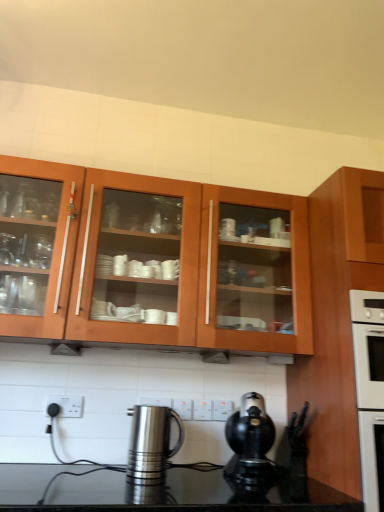
Describe the element at coordinates (155, 261) in the screenshot. The image size is (384, 512). I see `wooden cabinet at upper center, which ranks as the second cabinetry in right-to-left order` at that location.

Describe the element at coordinates (250, 442) in the screenshot. This screenshot has height=512, width=384. I see `black plastic coffee maker at lower center, which ranks as the 2th kitchen appliance in left-to-right order` at that location.

From the picture: How much space does white plastic electric outlet at lower center, marked as the first electric outlet in a left-to-right arrangement, occupy horizontally?

white plastic electric outlet at lower center, marked as the first electric outlet in a left-to-right arrangement, is 0.79 inches in width.

What do you see at coordinates (222, 409) in the screenshot? The image size is (384, 512). I see `white plastic electric outlet at center, positioned as the third electric outlet in left-to-right order` at bounding box center [222, 409].

Where is `white plastic electric outlet at center, which is counted as the 3th electric outlet, starting from the front`? The image size is (384, 512). white plastic electric outlet at center, which is counted as the 3th electric outlet, starting from the front is located at coordinates (222, 409).

This screenshot has width=384, height=512. I want to click on polished stainless steel kettle at lower center, the second kitchen appliance from the right, so click(151, 443).

Locate an element on the screen. wooden cabinet at upper center, arranged as the 1th cabinetry when viewed from the left is located at coordinates (155, 261).

From a real-world perspective, relative to white plastic electric outlet at center, positioned as the third electric outlet in left-to-right order, is white plastic electric outlet at lower center, acting as the first electric outlet starting from the front, vertically above or below?

white plastic electric outlet at lower center, acting as the first electric outlet starting from the front, is situated lower than white plastic electric outlet at center, positioned as the third electric outlet in left-to-right order, in the real world.

From the image's perspective, between white plastic electric outlet at lower center, which is the third electric outlet in right-to-left order, and white plastic electric outlet at center, acting as the first electric outlet starting from the right, who is located below?

white plastic electric outlet at center, acting as the first electric outlet starting from the right, from the image's perspective.

Does white plastic electric outlet at lower center, acting as the first electric outlet starting from the front, turn towards white plastic electric outlet at center, positioned as the third electric outlet in left-to-right order?

No.

Choose the correct answer: Is polished stainless steel kettle at lower center, which appears as the 1th kitchen appliance when viewed from the left, inside black plastic coffee maker at lower center, which ranks as the 2th kitchen appliance in left-to-right order, or outside it?

polished stainless steel kettle at lower center, which appears as the 1th kitchen appliance when viewed from the left, is outside black plastic coffee maker at lower center, which ranks as the 2th kitchen appliance in left-to-right order.

Does polished stainless steel kettle at lower center, the second kitchen appliance from the right, have a lesser height compared to black plastic coffee maker at lower center, placed as the first kitchen appliance when sorted from right to left?

Yes, polished stainless steel kettle at lower center, the second kitchen appliance from the right, is shorter than black plastic coffee maker at lower center, placed as the first kitchen appliance when sorted from right to left.

How different are the orientations of polished stainless steel kettle at lower center, the second kitchen appliance from the right, and black plastic coffee maker at lower center, which ranks as the 2th kitchen appliance in left-to-right order, in degrees?

They differ by 10.5 degrees in their facing directions.

Does white plastic electric outlet at lower center, which is the 3th electric outlet from back to front, have a smaller size compared to white plastic electric outlet at center, the 2th electric outlet viewed from the front?

Incorrect, white plastic electric outlet at lower center, which is the 3th electric outlet from back to front, is not smaller in size than white plastic electric outlet at center, the 2th electric outlet viewed from the front.

Which is correct: white plastic electric outlet at lower center, acting as the first electric outlet starting from the front, is inside white plastic electric outlet at center, which ranks as the 2th electric outlet in back-to-front order, or outside of it?

white plastic electric outlet at lower center, acting as the first electric outlet starting from the front, exists outside the volume of white plastic electric outlet at center, which ranks as the 2th electric outlet in back-to-front order.

Considering the relative sizes of white plastic electric outlet at lower center, acting as the first electric outlet starting from the front, and white plastic electric outlet at center, the 2th electric outlet positioned from the right, in the image provided, is white plastic electric outlet at lower center, acting as the first electric outlet starting from the front, thinner than white plastic electric outlet at center, the 2th electric outlet positioned from the right,?

Yes.

Which point is more distant from viewer, [73,414] or [190,419]?

The point [190,419] is behind.

Is white plastic electric outlet at center, which is counted as the 3th electric outlet, starting from the front, turned away from white plastic electric outlet at center, which ranks as the 2th electric outlet in back-to-front order?

No, white plastic electric outlet at center, which is counted as the 3th electric outlet, starting from the front, is not facing away from white plastic electric outlet at center, which ranks as the 2th electric outlet in back-to-front order.

Considering the relative sizes of white plastic electric outlet at center, which is counted as the 3th electric outlet, starting from the front, and white plastic electric outlet at center, the 2th electric outlet viewed from the front, in the image provided, is white plastic electric outlet at center, which is counted as the 3th electric outlet, starting from the front, smaller than white plastic electric outlet at center, the 2th electric outlet viewed from the front,?

Incorrect, white plastic electric outlet at center, which is counted as the 3th electric outlet, starting from the front, is not smaller in size than white plastic electric outlet at center, the 2th electric outlet viewed from the front.

Looking at this image, which is more to the left, white plastic electric outlet at center, positioned as the third electric outlet in left-to-right order, or white plastic electric outlet at center, which ranks as the 2th electric outlet in back-to-front order?

white plastic electric outlet at center, which ranks as the 2th electric outlet in back-to-front order, is more to the left.

At what (x,y) coordinates should I click in order to perform the action: click on electric outlet on the right of white plastic electric outlet at center, the 2th electric outlet positioned from the right. Please return your answer as a coordinate pair (x, y). This screenshot has width=384, height=512. Looking at the image, I should click on (222, 409).

From a real-world perspective, is white plastic electric outlet at center, marked as the first electric outlet in a back-to-front arrangement, positioned above or below black plastic coffee maker at lower center, placed as the first kitchen appliance when sorted from right to left?

From a real-world perspective, white plastic electric outlet at center, marked as the first electric outlet in a back-to-front arrangement, is physically above black plastic coffee maker at lower center, placed as the first kitchen appliance when sorted from right to left.

From the image's perspective, which one is positioned higher, white plastic electric outlet at center, which is counted as the 3th electric outlet, starting from the front, or black plastic coffee maker at lower center, placed as the first kitchen appliance when sorted from right to left?

white plastic electric outlet at center, which is counted as the 3th electric outlet, starting from the front, appears higher in the image.

Considering the sizes of white plastic electric outlet at center, positioned as the third electric outlet in left-to-right order, and black plastic coffee maker at lower center, placed as the first kitchen appliance when sorted from right to left, in the image, is white plastic electric outlet at center, positioned as the third electric outlet in left-to-right order, bigger or smaller than black plastic coffee maker at lower center, placed as the first kitchen appliance when sorted from right to left,?

Considering their sizes, white plastic electric outlet at center, positioned as the third electric outlet in left-to-right order, takes up less space than black plastic coffee maker at lower center, placed as the first kitchen appliance when sorted from right to left.

Between wooden cabinet at right, marked as the second cabinetry in a left-to-right arrangement, and polished stainless steel kettle at lower center, the second kitchen appliance from the right, which one has smaller size?

polished stainless steel kettle at lower center, the second kitchen appliance from the right, is smaller.

Who is taller, wooden cabinet at right, marked as the second cabinetry in a left-to-right arrangement, or polished stainless steel kettle at lower center, the second kitchen appliance from the right?

With more height is wooden cabinet at right, marked as the second cabinetry in a left-to-right arrangement.

Is wooden cabinet at right, the first cabinetry from the right, positioned with its back to polished stainless steel kettle at lower center, which appears as the 1th kitchen appliance when viewed from the left?

No, wooden cabinet at right, the first cabinetry from the right, is not facing away from polished stainless steel kettle at lower center, which appears as the 1th kitchen appliance when viewed from the left.

Considering the relative positions of wooden cabinet at right, the first cabinetry from the right, and polished stainless steel kettle at lower center, which appears as the 1th kitchen appliance when viewed from the left, in the image provided, is wooden cabinet at right, the first cabinetry from the right, to the left of polished stainless steel kettle at lower center, which appears as the 1th kitchen appliance when viewed from the left, from the viewer's perspective?

Incorrect, wooden cabinet at right, the first cabinetry from the right, is not on the left side of polished stainless steel kettle at lower center, which appears as the 1th kitchen appliance when viewed from the left.

Consider the image. Is white plastic electric outlet at lower center, acting as the first electric outlet starting from the front, looking in the opposite direction of wooden cabinet at upper center, which ranks as the second cabinetry in right-to-left order?

No.

Considering the relative sizes of white plastic electric outlet at lower center, which is the third electric outlet in right-to-left order, and wooden cabinet at upper center, which ranks as the second cabinetry in right-to-left order, in the image provided, is white plastic electric outlet at lower center, which is the third electric outlet in right-to-left order, bigger than wooden cabinet at upper center, which ranks as the second cabinetry in right-to-left order,?

Incorrect, white plastic electric outlet at lower center, which is the third electric outlet in right-to-left order, is not larger than wooden cabinet at upper center, which ranks as the second cabinetry in right-to-left order.

Is white plastic electric outlet at lower center, which is the 3th electric outlet from back to front, far away from wooden cabinet at upper center, arranged as the 1th cabinetry when viewed from the left?

No.

Do you think white plastic electric outlet at lower center, marked as the first electric outlet in a left-to-right arrangement, is within wooden cabinet at upper center, which ranks as the second cabinetry in right-to-left order, or outside of it?

white plastic electric outlet at lower center, marked as the first electric outlet in a left-to-right arrangement, lies outside wooden cabinet at upper center, which ranks as the second cabinetry in right-to-left order.

Identify the location of the 2nd electric outlet to the right when counting from the white plastic electric outlet at lower center, which is the 3th electric outlet from back to front. The height and width of the screenshot is (512, 384). (222, 409).

Locate an element on the screen. kitchen appliance on the left of black plastic coffee maker at lower center, which ranks as the 2th kitchen appliance in left-to-right order is located at coordinates (151, 443).

Considering their positions, is white plastic electric outlet at center, positioned as the third electric outlet in left-to-right order, positioned further to wooden cabinet at upper center, which ranks as the second cabinetry in right-to-left order, than white plastic electric outlet at lower center, marked as the first electric outlet in a left-to-right arrangement?

The object further to wooden cabinet at upper center, which ranks as the second cabinetry in right-to-left order, is white plastic electric outlet at lower center, marked as the first electric outlet in a left-to-right arrangement.

From the image, which object appears to be farther from polished stainless steel kettle at lower center, which appears as the 1th kitchen appliance when viewed from the left, wooden cabinet at right, marked as the second cabinetry in a left-to-right arrangement, or white plastic electric outlet at center, acting as the first electric outlet starting from the right?

wooden cabinet at right, marked as the second cabinetry in a left-to-right arrangement, lies further to polished stainless steel kettle at lower center, which appears as the 1th kitchen appliance when viewed from the left, than the other object.

Considering their positions, is white plastic electric outlet at center, marked as the first electric outlet in a back-to-front arrangement, positioned closer to black plastic coffee maker at lower center, placed as the first kitchen appliance when sorted from right to left, than wooden cabinet at upper center, which ranks as the second cabinetry in right-to-left order?

Based on the image, white plastic electric outlet at center, marked as the first electric outlet in a back-to-front arrangement, appears to be nearer to black plastic coffee maker at lower center, placed as the first kitchen appliance when sorted from right to left.

From the image, which object appears to be farther from white plastic electric outlet at center, positioned as the third electric outlet in left-to-right order, polished stainless steel kettle at lower center, which appears as the 1th kitchen appliance when viewed from the left, or wooden cabinet at upper center, arranged as the 1th cabinetry when viewed from the left?

wooden cabinet at upper center, arranged as the 1th cabinetry when viewed from the left, is further to white plastic electric outlet at center, positioned as the third electric outlet in left-to-right order.

When comparing their distances from white plastic electric outlet at center, the 2th electric outlet positioned from the right, does wooden cabinet at right, marked as the second cabinetry in a left-to-right arrangement, or black plastic coffee maker at lower center, which ranks as the 2th kitchen appliance in left-to-right order, seem closer?

Among the two, black plastic coffee maker at lower center, which ranks as the 2th kitchen appliance in left-to-right order, is located nearer to white plastic electric outlet at center, the 2th electric outlet positioned from the right.

From the image, which object appears to be farther from polished stainless steel kettle at lower center, which appears as the 1th kitchen appliance when viewed from the left, wooden cabinet at right, marked as the second cabinetry in a left-to-right arrangement, or white plastic electric outlet at lower center, acting as the first electric outlet starting from the front?

wooden cabinet at right, marked as the second cabinetry in a left-to-right arrangement, lies further to polished stainless steel kettle at lower center, which appears as the 1th kitchen appliance when viewed from the left, than the other object.

When comparing their distances from black plastic coffee maker at lower center, placed as the first kitchen appliance when sorted from right to left, does wooden cabinet at right, the first cabinetry from the right, or white plastic electric outlet at lower center, marked as the first electric outlet in a left-to-right arrangement, seem further?

Based on the image, white plastic electric outlet at lower center, marked as the first electric outlet in a left-to-right arrangement, appears to be further to black plastic coffee maker at lower center, placed as the first kitchen appliance when sorted from right to left.

Considering their positions, is wooden cabinet at upper center, which ranks as the second cabinetry in right-to-left order, positioned closer to wooden cabinet at right, the first cabinetry from the right, than polished stainless steel kettle at lower center, which appears as the 1th kitchen appliance when viewed from the left?

wooden cabinet at upper center, which ranks as the second cabinetry in right-to-left order.

This screenshot has height=512, width=384. Find the location of `kitchen appliance between white plastic electric outlet at lower center, which is the 3th electric outlet from back to front, and white plastic electric outlet at center, positioned as the third electric outlet in left-to-right order`. kitchen appliance between white plastic electric outlet at lower center, which is the 3th electric outlet from back to front, and white plastic electric outlet at center, positioned as the third electric outlet in left-to-right order is located at coordinates (151, 443).

In order to click on cabinetry situated between white plastic electric outlet at lower center, which is the third electric outlet in right-to-left order, and wooden cabinet at right, the first cabinetry from the right, from left to right in this screenshot , I will do `click(155, 261)`.

I want to click on cabinetry between white plastic electric outlet at lower center, which is the 3th electric outlet from back to front, and black plastic coffee maker at lower center, placed as the first kitchen appliance when sorted from right to left, from left to right, so click(x=155, y=261).

Where is `kitchen appliance that lies between wooden cabinet at upper center, which ranks as the second cabinetry in right-to-left order, and polished stainless steel kettle at lower center, which appears as the 1th kitchen appliance when viewed from the left, from top to bottom`? This screenshot has width=384, height=512. kitchen appliance that lies between wooden cabinet at upper center, which ranks as the second cabinetry in right-to-left order, and polished stainless steel kettle at lower center, which appears as the 1th kitchen appliance when viewed from the left, from top to bottom is located at coordinates (250, 442).